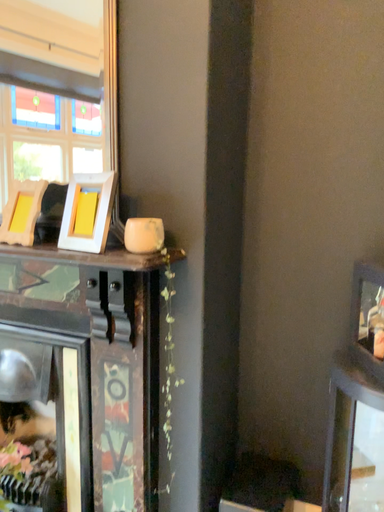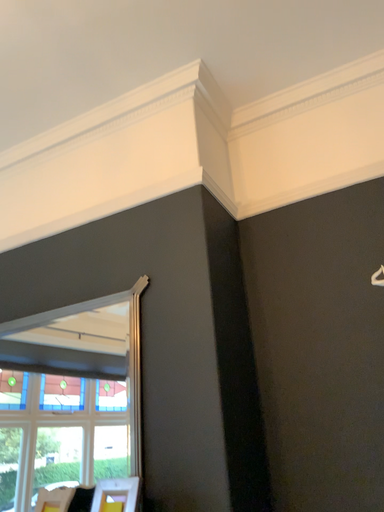
Question: Which way did the camera rotate in the video?

Choices:
 (A) rotated downward
 (B) rotated upward

Answer: (B)